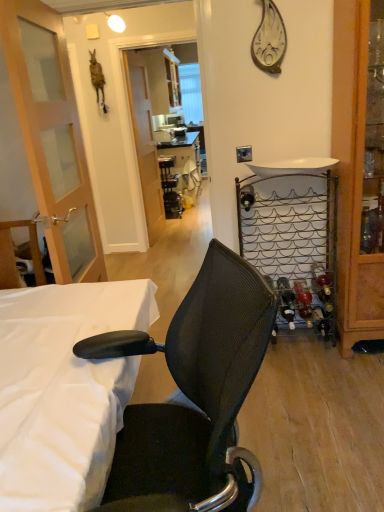
What is the approximate width of black mesh office chair at center?

It is 21.58 inches.

In order to click on black plastic table at center in this screenshot , I will do `click(184, 164)`.

Measure the distance between black plastic table at center and camera.

They are 5.39 meters apart.

This screenshot has height=512, width=384. In order to click on wooden door at left in this screenshot , I will do `click(52, 137)`.

The width and height of the screenshot is (384, 512). Find the location of `metallic leaf-shaped clock at upper right`. metallic leaf-shaped clock at upper right is located at coordinates (269, 40).

Which point is more forward, (280, 169) or (272, 20)?

The point (272, 20) is closer.

From the image's perspective, is white glossy sink at upper right positioned above or below metallic leaf-shaped clock at upper right?

From the image's perspective, white glossy sink at upper right appears below metallic leaf-shaped clock at upper right.

How many degrees apart are the facing directions of white glossy sink at upper right and metallic leaf-shaped clock at upper right?

0.578 degrees.

Based on the photo, is white glossy sink at upper right smaller than metallic leaf-shaped clock at upper right?

Incorrect, white glossy sink at upper right is not smaller in size than metallic leaf-shaped clock at upper right.

Is wooden cabinet at right oriented away from transparent glass screen door at center?

That's not correct — wooden cabinet at right is not looking away from transparent glass screen door at center.

How much distance is there between wooden cabinet at right and transparent glass screen door at center?

wooden cabinet at right and transparent glass screen door at center are 2.72 meters apart from each other.

Between wooden cabinet at right and transparent glass screen door at center, which one appears on the left side from the viewer's perspective?

transparent glass screen door at center.

Is point (336, 0) positioned after point (135, 70)?

That is False.

Is wooden cabinet at right taller or shorter than white glossy sink at upper right?

In the image, wooden cabinet at right appears to be taller than white glossy sink at upper right.

Considering the sizes of objects wooden cabinet at right and white glossy sink at upper right in the image provided, who is thinner, wooden cabinet at right or white glossy sink at upper right?

white glossy sink at upper right.

What are the coordinates of `cabinetry that is under the white glossy sink at upper right (from a real-world perspective)` in the screenshot? It's located at (355, 181).

Is wooden cabinet at right at the left side of white glossy sink at upper right?

In fact, wooden cabinet at right is to the right of white glossy sink at upper right.

Is wooden cabinet at right oriented away from wooden door at left?

No, wooden cabinet at right's orientation is not away from wooden door at left.

Does wooden cabinet at right have a lesser height compared to wooden door at left?

Incorrect, the height of wooden cabinet at right does not fall short of that of wooden door at left.

Can you tell me how much wooden cabinet at right and wooden door at left differ in facing direction?

94.5 degrees separate the facing orientations of wooden cabinet at right and wooden door at left.

From a real-world perspective, who is located higher, wooden cabinet at right or wooden door at left?

In real-world perspective, wooden door at left is above.

Which of these two, white fabric bed at lower left, placed as the 2th bed when sorted from back to front, or white glossy sink at upper right, is bigger?

Bigger between the two is white fabric bed at lower left, placed as the 2th bed when sorted from back to front.

Between point (67, 352) and point (265, 173), which one is positioned behind?

Point (265, 173)

Where is `bed that appears in front of the white glossy sink at upper right`? bed that appears in front of the white glossy sink at upper right is located at coordinates (63, 390).

What's the angular difference between white fabric bed at lower left, the 1th bed when ordered from front to back, and white glossy sink at upper right's facing directions?

The angular difference between white fabric bed at lower left, the 1th bed when ordered from front to back, and white glossy sink at upper right is 90.8 degrees.

Between black plastic table at center and metallic wire wine rack at right, the first bed positioned from the back, which one appears on the right side from the viewer's perspective?

Positioned to the right is metallic wire wine rack at right, the first bed positioned from the back.

From the image's perspective, which is below, black plastic table at center or metallic wire wine rack at right, arranged as the 1th bed when viewed from the right?

metallic wire wine rack at right, arranged as the 1th bed when viewed from the right.

Is point (195, 181) closer or farther from the camera than point (308, 317)?

Point (195, 181) is farther from the camera than point (308, 317).

Is black plastic table at center not close to metallic wire wine rack at right, arranged as the 1th bed when viewed from the right?

black plastic table at center is far away from metallic wire wine rack at right, arranged as the 1th bed when viewed from the right.

Considering the relative positions of metallic leaf-shaped clock at upper right and transparent glass screen door at center in the image provided, is metallic leaf-shaped clock at upper right to the left or to the right of transparent glass screen door at center?

Based on their positions, metallic leaf-shaped clock at upper right is located to the right of transparent glass screen door at center.

Looking at this image, is the position of metallic leaf-shaped clock at upper right more distant than that of transparent glass screen door at center?

No, metallic leaf-shaped clock at upper right is closer to the camera.

Who is shorter, metallic leaf-shaped clock at upper right or transparent glass screen door at center?

metallic leaf-shaped clock at upper right.

Is metallic leaf-shaped clock at upper right inside or outside of transparent glass screen door at center?

metallic leaf-shaped clock at upper right is not enclosed by transparent glass screen door at center.

You are a GUI agent. You are given a task and a screenshot of the screen. Output one action in this format:
    pyautogui.click(x=<x>, y=<y>)
    Task: Click on the sink on the right of metallic leaf-shaped clock at upper right
    This screenshot has height=512, width=384.
    Given the screenshot: What is the action you would take?
    pyautogui.click(x=293, y=166)

Where is `cabinetry located in front of the transparent glass screen door at center`? This screenshot has width=384, height=512. cabinetry located in front of the transparent glass screen door at center is located at coordinates (355, 181).

When comparing their distances from wooden door at left, does metallic wire wine rack at right, the first bed positioned from the back, or wooden cabinet at right seem further?

wooden cabinet at right lies further to wooden door at left than the other object.

Based on their spatial positions, is metallic wire wine rack at right, arranged as the 2th bed when viewed from the left, or white fabric bed at lower left, the 1th bed viewed from the left, further from white glossy sink at upper right?

white fabric bed at lower left, the 1th bed viewed from the left, is positioned further to the anchor white glossy sink at upper right.

When comparing their distances from metallic wire wine rack at right, the first bed positioned from the back, does black mesh office chair at center or wooden cabinet at right seem closer?

wooden cabinet at right.

Based on the photo, looking at the image, which one is located closer to white fabric bed at lower left, which is the second bed in right-to-left order, white glossy sink at upper right or metallic wire wine rack at right, the 2th bed in the front-to-back sequence?

The object closer to white fabric bed at lower left, which is the second bed in right-to-left order, is metallic wire wine rack at right, the 2th bed in the front-to-back sequence.

Which object lies nearer to the anchor point black mesh office chair at center, white fabric bed at lower left, the 1th bed viewed from the left, or wooden cabinet at right?

white fabric bed at lower left, the 1th bed viewed from the left, is closer to black mesh office chair at center.

Which object lies further to the anchor point wooden cabinet at right, wooden door at left or white fabric bed at lower left, the 1th bed viewed from the left?

Based on the image, wooden door at left appears to be further to wooden cabinet at right.

Considering their positions, is metallic leaf-shaped clock at upper right positioned closer to wooden cabinet at right than black mesh office chair at center?

metallic leaf-shaped clock at upper right lies closer to wooden cabinet at right than the other object.

Estimate the real-world distances between objects in this image. Which object is closer to metallic wire wine rack at right, arranged as the 2th bed when viewed from the left, white fabric bed at lower left, which is the second bed in right-to-left order, or metallic leaf-shaped clock at upper right?

metallic leaf-shaped clock at upper right.

Identify the location of sink positioned between black mesh office chair at center and metallic wire wine rack at right, the first bed positioned from the back, from near to far. This screenshot has height=512, width=384. (293, 166).

The height and width of the screenshot is (512, 384). What are the coordinates of `door between metallic leaf-shaped clock at upper right and black mesh office chair at center in the vertical direction` in the screenshot? It's located at (52, 137).

Locate an element on the screen. This screenshot has width=384, height=512. sink positioned between white fabric bed at lower left, which is the second bed in right-to-left order, and black plastic table at center from near to far is located at coordinates (293, 166).

What are the coordinates of `chair that lies between metallic leaf-shaped clock at upper right and white fabric bed at lower left, placed as the 2th bed when sorted from back to front, from top to bottom` in the screenshot? It's located at (193, 393).